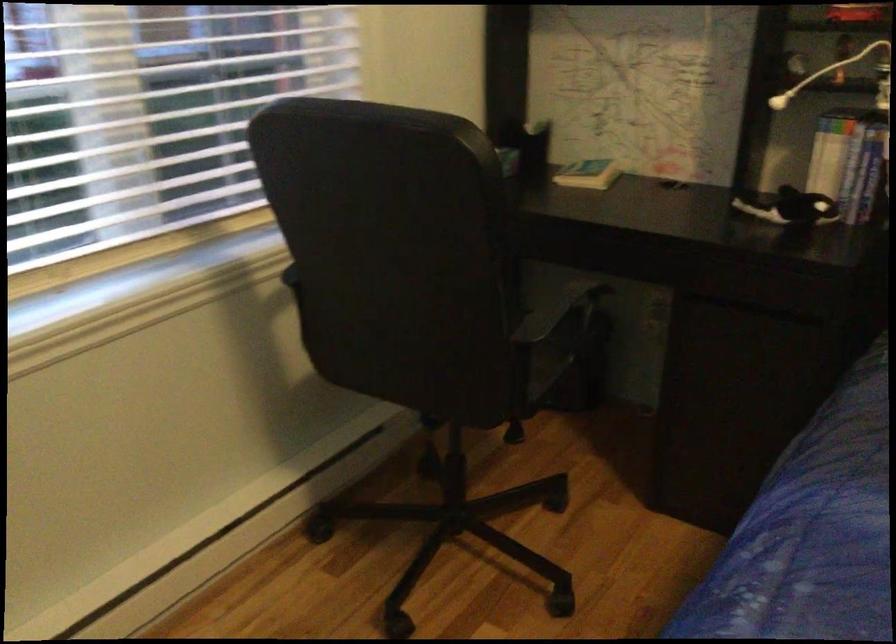
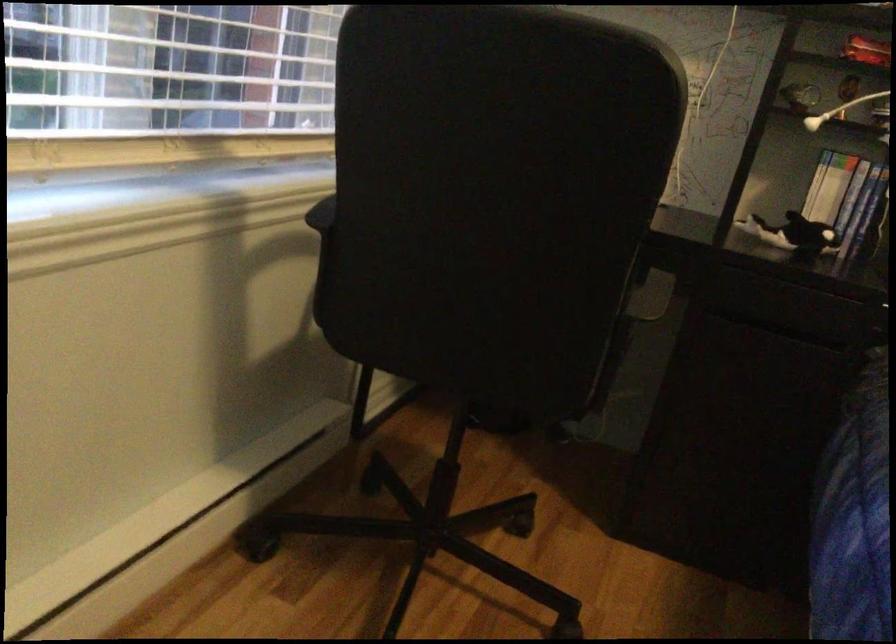
Which direction would the cameraman need to move to produce the second image?

The movement direction of the cameraman is left, forward.